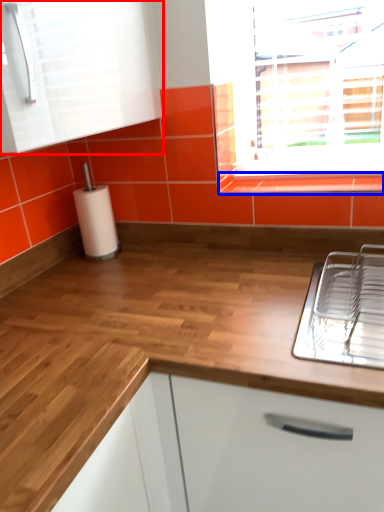
Question: Which object is further to the camera taking this photo, cabinetry (highlighted by a red box) or window sill (highlighted by a blue box)?

Choices:
 (A) cabinetry
 (B) window sill

Answer: (B)